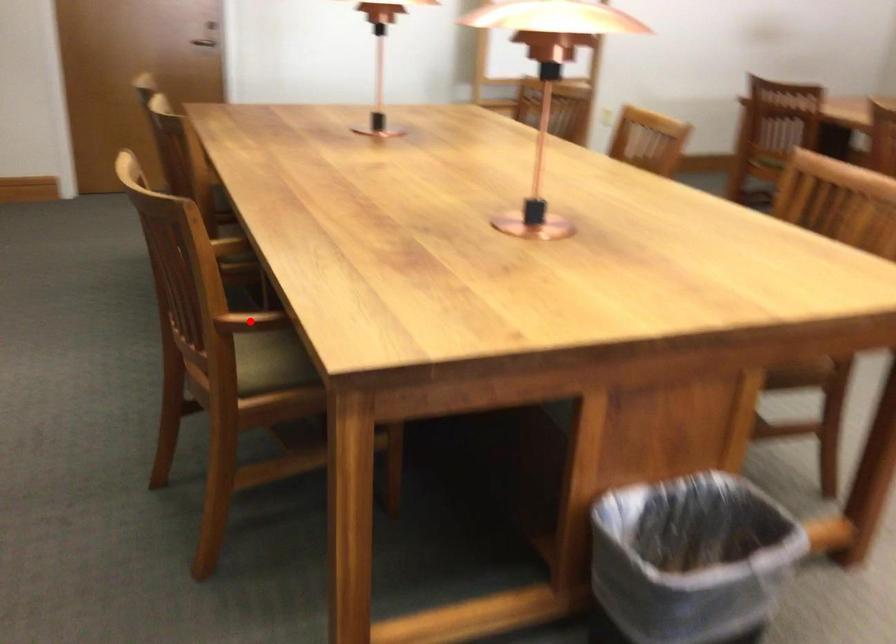
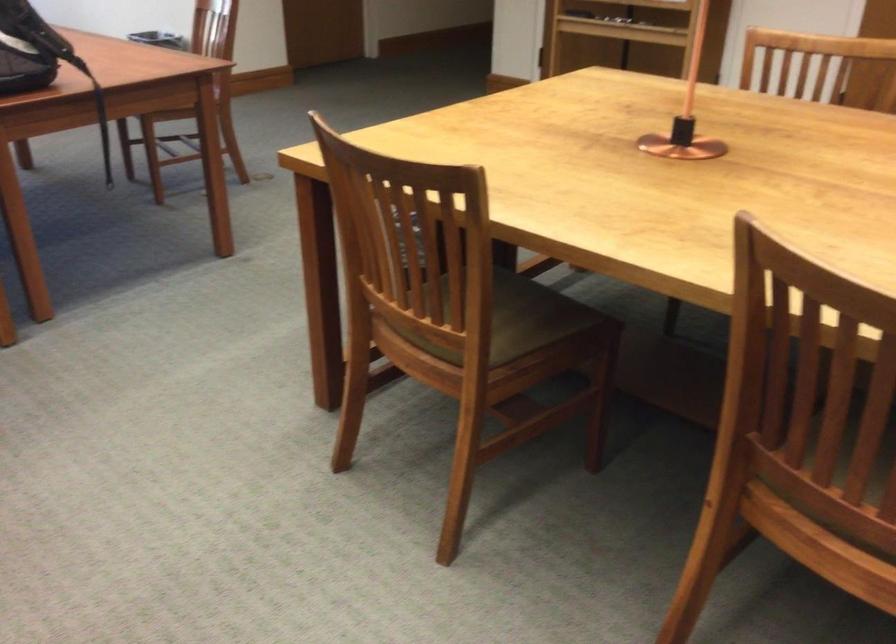
Question: I am providing you with two images of the same scene from different viewpoints. A red point is marked on the first image. Is the red point's position out of view in image 2?

Choices:
 (A) Yes
 (B) No

Answer: (A)